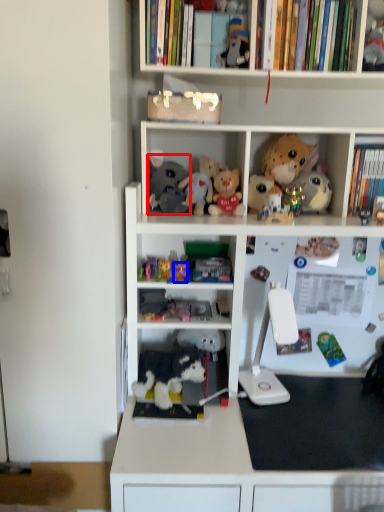
Question: Which of the following is the farthest to the observer, toy (highlighted by a red box) or toy (highlighted by a blue box)?

Choices:
 (A) toy
 (B) toy

Answer: (A)